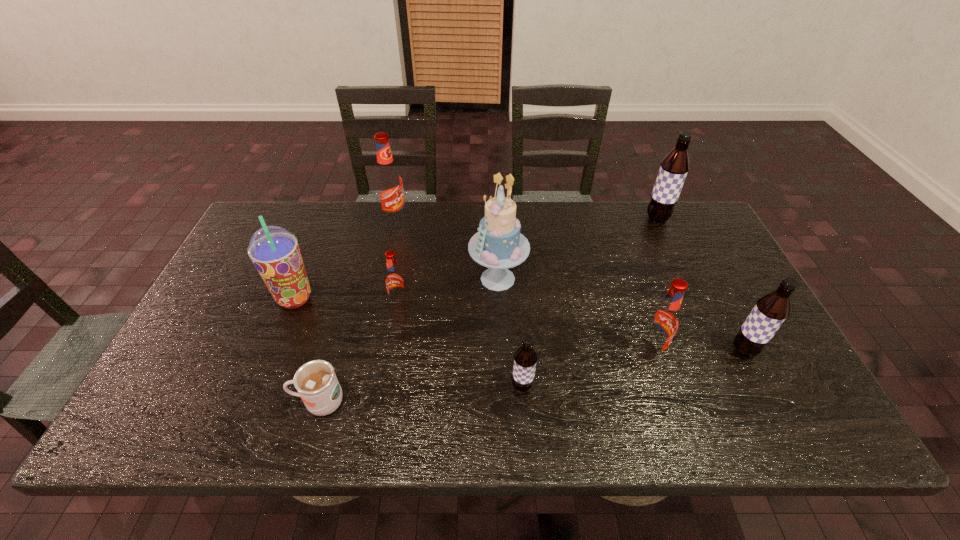
You are a GUI agent. You are given a task and a screenshot of the screen. Output one action in this format:
    pyautogui.click(x=<x>, y=<y>)
    Task: Click on the blue cake
    The width and height of the screenshot is (960, 540).
    Given the screenshot: What is the action you would take?
    pyautogui.click(x=498, y=245)

Where is `the biggest brown root beer`? The height and width of the screenshot is (540, 960). the biggest brown root beer is located at coordinates (674, 168).

The image size is (960, 540). I want to click on the biggest red root beer, so click(388, 180).

Find the location of a particular element. This screenshot has height=540, width=960. smoothie is located at coordinates coord(275,252).

The height and width of the screenshot is (540, 960). I want to click on the rightmost red root beer, so click(663, 321).

Where is `the third object from right to left`? The height and width of the screenshot is (540, 960). the third object from right to left is located at coordinates (663, 321).

In order to click on the second smallest brown root beer in this screenshot , I will do `click(770, 311)`.

Find the location of a particular element. the second nearest red root beer is located at coordinates (395, 282).

What are the coordinates of `the third farthest root beer` in the screenshot? It's located at (395, 282).

You are a GUI agent. You are given a task and a screenshot of the screen. Output one action in this format:
    pyautogui.click(x=<x>, y=<y>)
    Task: Click on the leftmost brown root beer
    
    Given the screenshot: What is the action you would take?
    pyautogui.click(x=525, y=358)